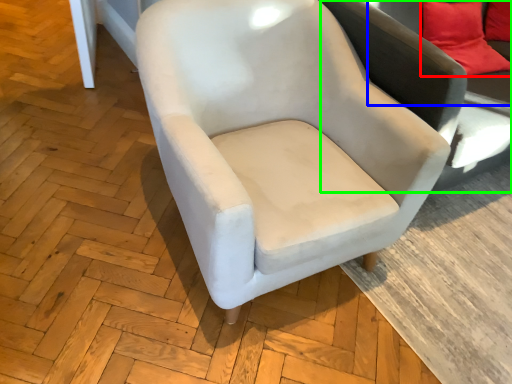
Question: Which object is the farthest from pillow (highlighted by a red box)? Choose among these: couch (highlighted by a blue box) or swivel chair (highlighted by a green box).

Choices:
 (A) couch
 (B) swivel chair

Answer: (B)